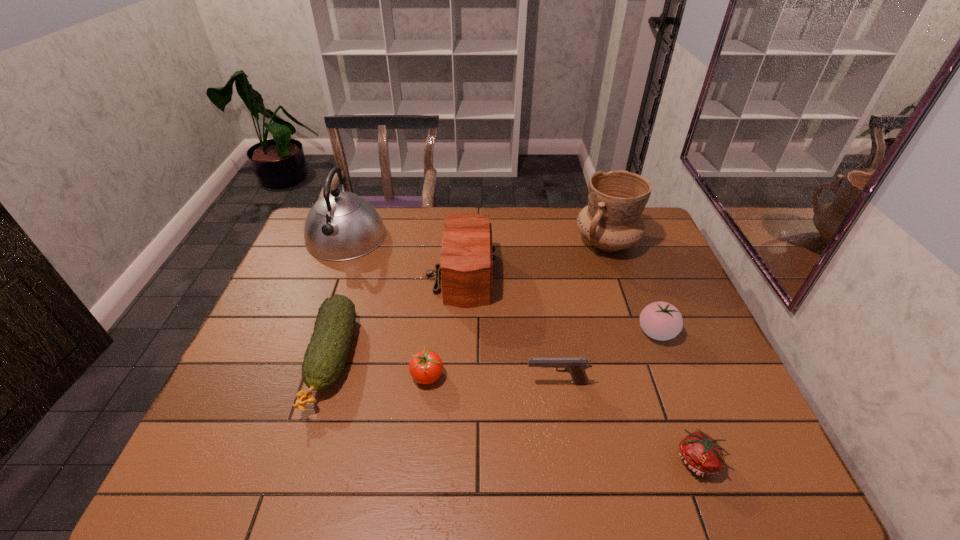
Locate an element on the screen. Image resolution: width=960 pixels, height=540 pixels. object that is the seventh closest to the leftmost tomato is located at coordinates (612, 221).

Locate which tomato ranks second in proximity to the nearest tomato. Please provide its 2D coordinates. Your answer should be formatted as a tuple, i.e. [(x, y)], where the tuple contains the x and y coordinates of a point satisfying the conditions above.

[(425, 367)]

Point out which tomato is positioned as the second nearest to the kettle. Please provide its 2D coordinates. Your answer should be formatted as a tuple, i.e. [(x, y)], where the tuple contains the x and y coordinates of a point satisfying the conditions above.

[(660, 320)]

Where is `free space that satisfies the following two spatial constraints: 1. from the spout of the leftmost tomato; 2. on the left side of the kettle`? free space that satisfies the following two spatial constraints: 1. from the spout of the leftmost tomato; 2. on the left side of the kettle is located at coordinates (294, 376).

I want to click on blank space that satisfies the following two spatial constraints: 1. at the blossom end of the cucumber; 2. on the left side of the leftmost tomato, so click(x=326, y=376).

This screenshot has width=960, height=540. Find the location of `free location that satisfies the following two spatial constraints: 1. from the spout of the tallest tomato; 2. on the right side of the kettle`. free location that satisfies the following two spatial constraints: 1. from the spout of the tallest tomato; 2. on the right side of the kettle is located at coordinates click(310, 332).

Where is `vacant space that satisfies the following two spatial constraints: 1. from the spout of the kettle; 2. on the right side of the pottery`? vacant space that satisfies the following two spatial constraints: 1. from the spout of the kettle; 2. on the right side of the pottery is located at coordinates (344, 242).

You are a GUI agent. You are given a task and a screenshot of the screen. Output one action in this format:
    pyautogui.click(x=<x>, y=<y>)
    Task: Click on the vacant position in the image that satisfies the following two spatial constraints: 1. on the front-facing side of the sixth shortest object; 2. on the right side of the tallest tomato
    This screenshot has width=960, height=540.
    Given the screenshot: What is the action you would take?
    pyautogui.click(x=456, y=332)

The height and width of the screenshot is (540, 960). I want to click on vacant space that satisfies the following two spatial constraints: 1. on the front-facing side of the sixth shortest object; 2. at the blossom end of the cucumber, so click(455, 360).